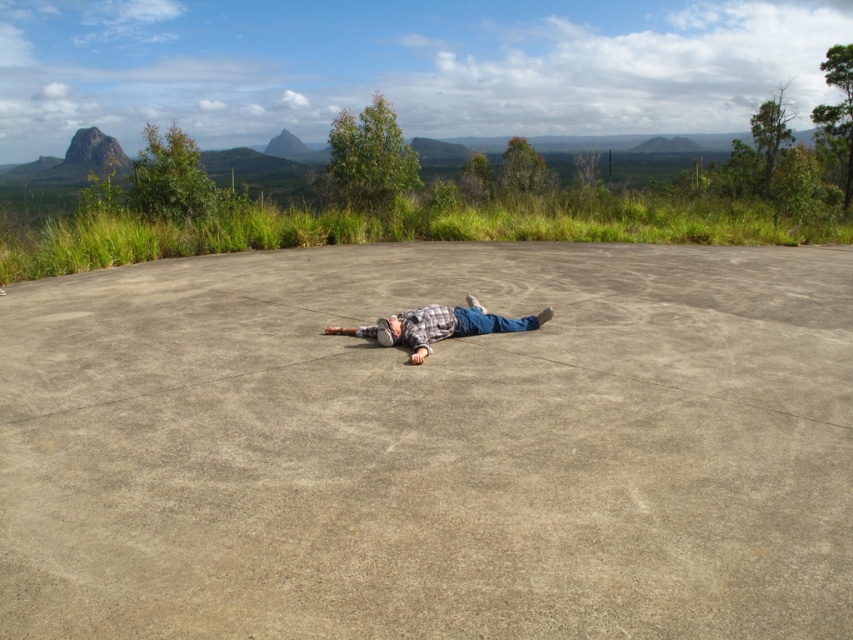
Question: Can you confirm if gray concrete at center is positioned above plaid shirt at center?

Choices:
 (A) yes
 (B) no

Answer: (B)

Question: Among these objects, which one is farthest from the camera?

Choices:
 (A) gray concrete at center
 (B) plaid shirt at center

Answer: (B)

Question: Can you confirm if gray concrete at center is wider than plaid shirt at center?

Choices:
 (A) no
 (B) yes

Answer: (B)

Question: Is gray concrete at center closer to the viewer compared to plaid shirt at center?

Choices:
 (A) no
 (B) yes

Answer: (B)

Question: Among these points, which one is farthest from the camera?

Choices:
 (A) (427, 310)
 (B) (776, 372)

Answer: (A)